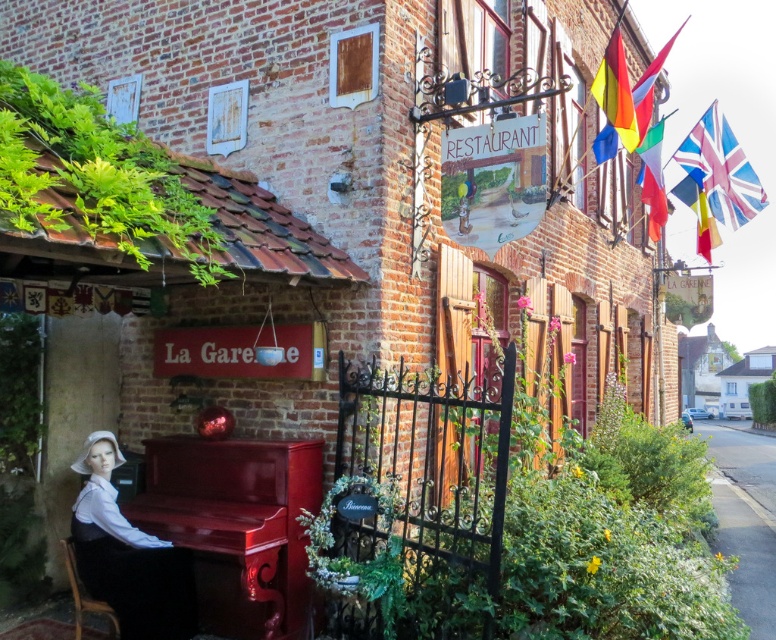
Question: Which of the following is the farthest from the observer?

Choices:
 (A) glossy red piano at lower left
 (B) wooden chair at lower left
 (C) rainbow fabric flag at upper right
 (D) union jack fabric flag at upper right

Answer: (D)

Question: Which object is farther from the camera taking this photo?

Choices:
 (A) blue fabric flag at upper right
 (B) glossy red piano at lower left

Answer: (A)

Question: Is gravel at lower right smaller than multicolored fabric flags at upper right?

Choices:
 (A) no
 (B) yes

Answer: (B)

Question: Which of these objects is positioned farthest from the blue fabric flag at upper right?

Choices:
 (A) glossy red piano at lower left
 (B) rainbow fabric flag at upper right
 (C) wooden chair at lower left

Answer: (C)

Question: Can you confirm if glossy red piano at lower left is wider than smooth white blouse at lower left?

Choices:
 (A) yes
 (B) no

Answer: (A)

Question: Is glossy red piano at lower left positioned in front of smooth white blouse at lower left?

Choices:
 (A) no
 (B) yes

Answer: (B)